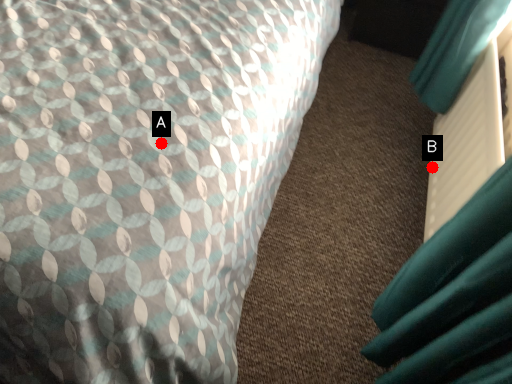
Question: Two points are circled on the image, labeled by A and B beside each circle. Which point is farther from the camera taking this photo?

Choices:
 (A) A is further
 (B) B is further

Answer: (B)